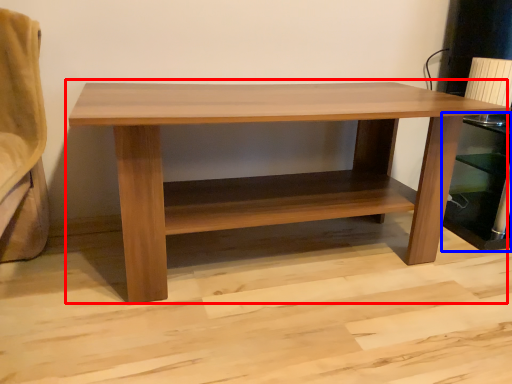
Question: Among these objects, which one is nearest to the camera, table (highlighted by a red box) or shelf (highlighted by a blue box)?

Choices:
 (A) table
 (B) shelf

Answer: (A)